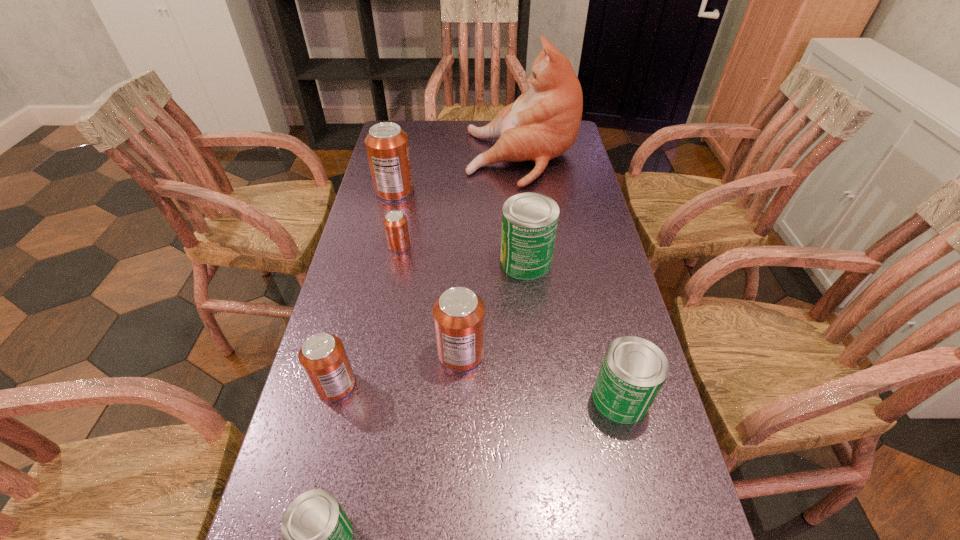
You are a GUI agent. You are given a task and a screenshot of the screen. Output one action in this format:
    pyautogui.click(x=<x>, y=<y>)
    Task: Click on the tallest object
    The height and width of the screenshot is (540, 960).
    Given the screenshot: What is the action you would take?
    pyautogui.click(x=543, y=123)

Identify the location of cat. The image size is (960, 540). (543, 123).

Find the location of a particular element. the second tallest object is located at coordinates (387, 145).

You are a GUI agent. You are given a task and a screenshot of the screen. Output one action in this format:
    pyautogui.click(x=<x>, y=<y>)
    Task: Click on the biggest orange can
    
    Given the screenshot: What is the action you would take?
    pos(387,145)

Identify the location of the biggest green can. (529, 220).

Locate an element on the screen. the second green can from right to left is located at coordinates (529, 220).

This screenshot has height=540, width=960. What are the coordinates of `the fifth can from left to right` in the screenshot? It's located at (459, 314).

Image resolution: width=960 pixels, height=540 pixels. I want to click on the second biggest orange can, so click(459, 314).

Locate an element on the screen. The image size is (960, 540). the second smallest orange can is located at coordinates [323, 358].

Locate an element on the screen. Image resolution: width=960 pixels, height=540 pixels. the second biggest green can is located at coordinates point(633,370).